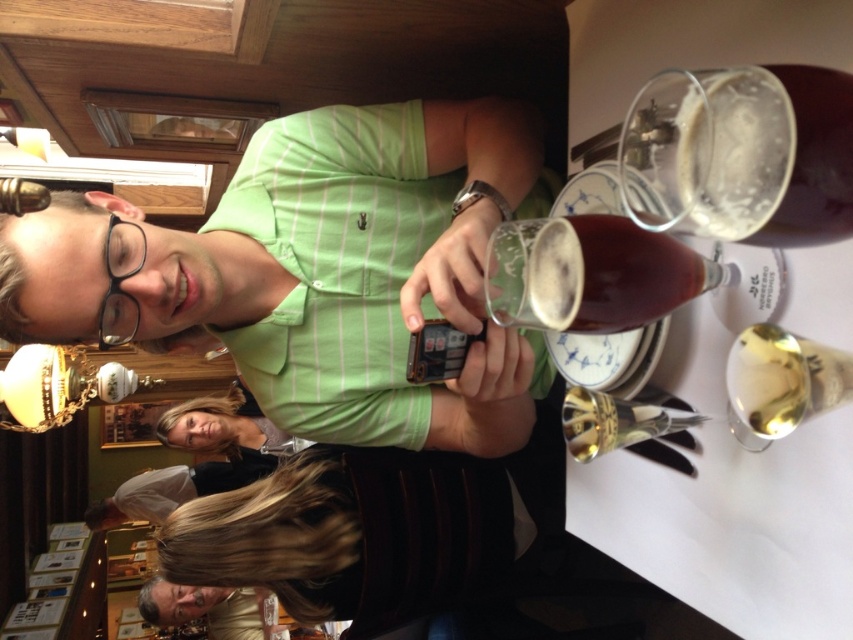
Question: Is green striped shirt at center wider than translucent glass at upper right?

Choices:
 (A) yes
 (B) no

Answer: (A)

Question: Which of the following is the farthest from the observer?

Choices:
 (A) green striped shirt at center
 (B) brown matte glass at upper center

Answer: (A)

Question: Which of these objects is positioned farthest from the clear glass at upper right?

Choices:
 (A) brown matte glass at upper center
 (B) translucent glass at upper right
 (C) green striped shirt at center

Answer: (C)

Question: Is clear glass at upper right above brown matte glass at upper center?

Choices:
 (A) yes
 (B) no

Answer: (A)

Question: Is clear glass at upper right positioned in front of brown matte glass at upper center?

Choices:
 (A) no
 (B) yes

Answer: (B)

Question: Which point is farther to the camera?

Choices:
 (A) clear glass at upper right
 (B) translucent glass at upper right
 (C) brown matte glass at upper center

Answer: (C)